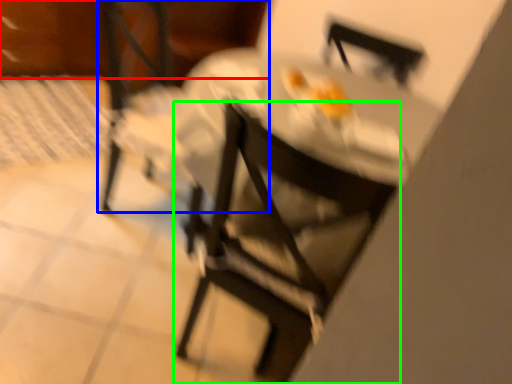
Question: Considering the real-world distances, which object is farthest from leftover (highlighted by a red box)? chair (highlighted by a blue box) or chair (highlighted by a green box)?

Choices:
 (A) chair
 (B) chair

Answer: (B)